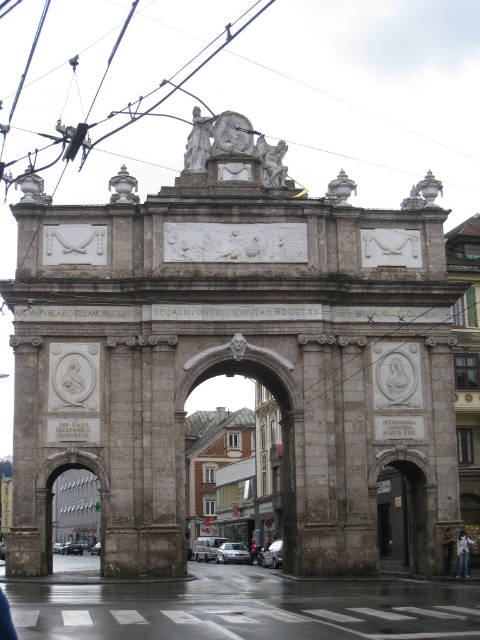
Question: Is white marble statue at upper center to the right of dark brown leather jacket at center from the viewer's perspective?

Choices:
 (A) no
 (B) yes

Answer: (A)

Question: Which object is closer to the camera taking this photo?

Choices:
 (A) polished stone statue at center
 (B) gray stone archway at center
 (C) brown leather jacket at center

Answer: (B)

Question: Which of the following is the closest to the observer?

Choices:
 (A) (193, 513)
 (B) (263, 136)
 (C) (183, 168)
 (D) (467, 556)

Answer: (D)

Question: Which of the following is the closest to the observer?

Choices:
 (A) (460, 573)
 (B) (192, 429)

Answer: (A)

Question: Does gray stone archway at center appear under blurred fabric person at center?

Choices:
 (A) no
 (B) yes

Answer: (A)

Question: Observing the image, what is the correct spatial positioning of white marble statue at upper center in reference to brown leather jacket at center?

Choices:
 (A) right
 (B) left

Answer: (B)